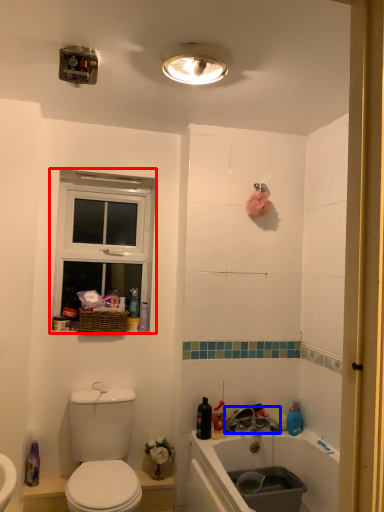
Question: Which object is further to the camera taking this photo, window (highlighted by a red box) or tap (highlighted by a blue box)?

Choices:
 (A) window
 (B) tap

Answer: (A)